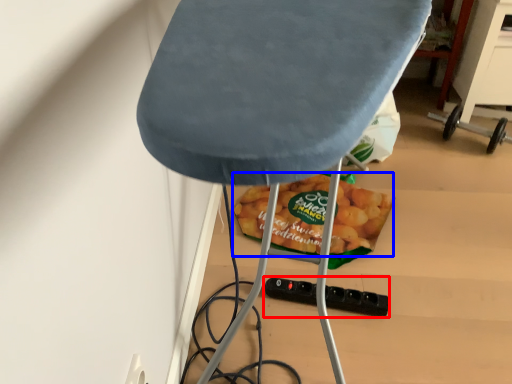
Question: Which point is closer to the camera, socket (highlighted by a red box) or snack (highlighted by a blue box)?

Choices:
 (A) socket
 (B) snack

Answer: (A)